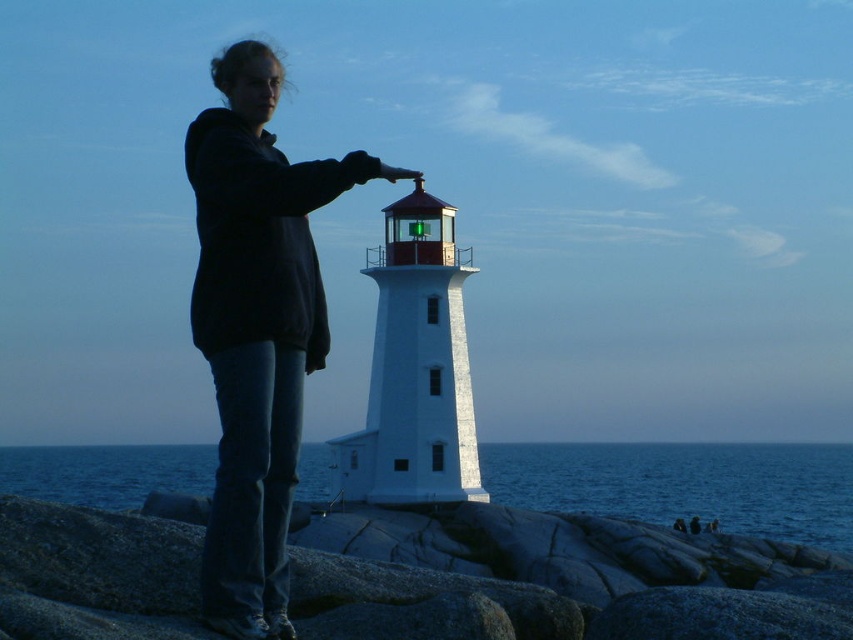
You are a geologist who needs to locate the granite rocks at center in the image. According to the coordinates provided, where exactly would you find them?

The granite rocks at center are located at coordinates point (x=582, y=593).